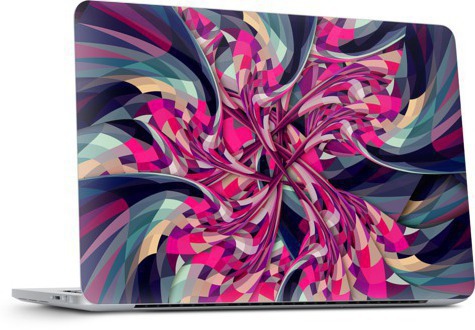
In order to click on keys on laptop in this screenshot , I will do `click(72, 292)`.